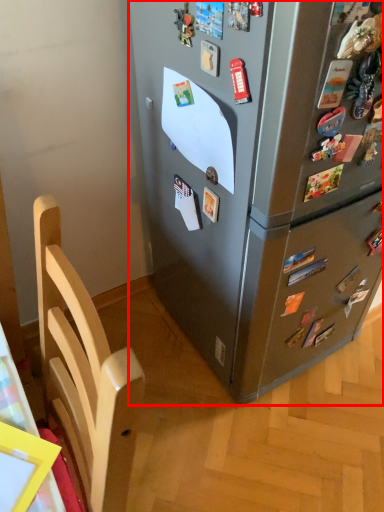
Question: Observing the image, what is the correct spatial positioning of refrigerator (annotated by the red box) in reference to furniture?

Choices:
 (A) left
 (B) right

Answer: (B)